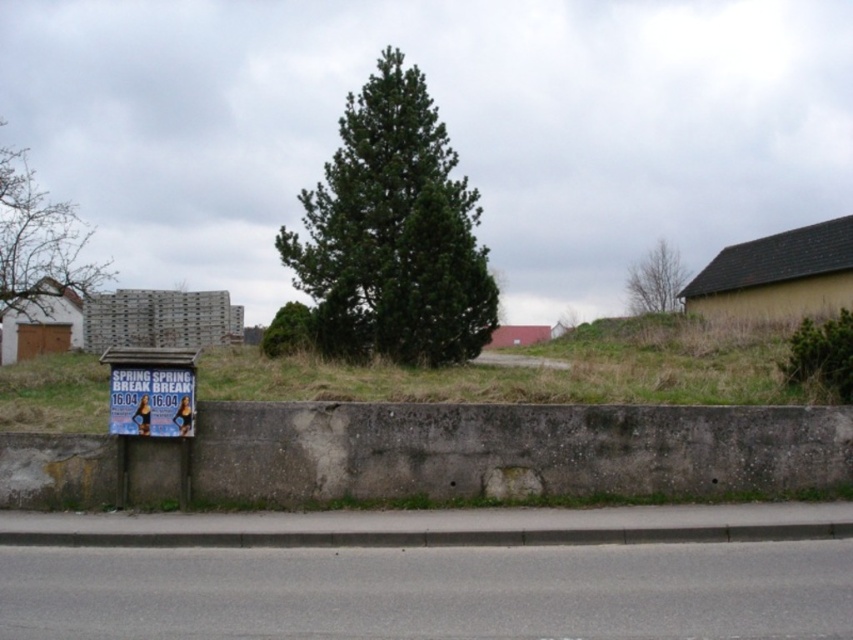
You are a pedestrian standing on the paved road and want to see the blue paper sign at lower left and the green leafy tree at upper center. Which object is closer to your eye level?

The blue paper sign at lower left is shorter than the green leafy tree at upper center, so the blue paper sign at lower left is closer to your eye level.

You are a hiker standing on the road and want to take a photo of both the green leafy tree at left and the blue paper sign at lower left. Which object should you focus on first to ensure both are in the frame?

You should focus on the green leafy tree at left first because it is larger than the blue paper sign at lower left, so you need to position yourself to include its full size while still capturing the smaller blue paper sign at lower left in the same frame.

You are standing at the road in the image and want to walk towards the grassy area. There are two points marked in the scene. The first point is at coordinates point (161, 390) and the second is at point (677, 285). Which point is closer to you as you face the road?

Point (161, 390) is in front of point (677, 285), so the first point is closer to you.